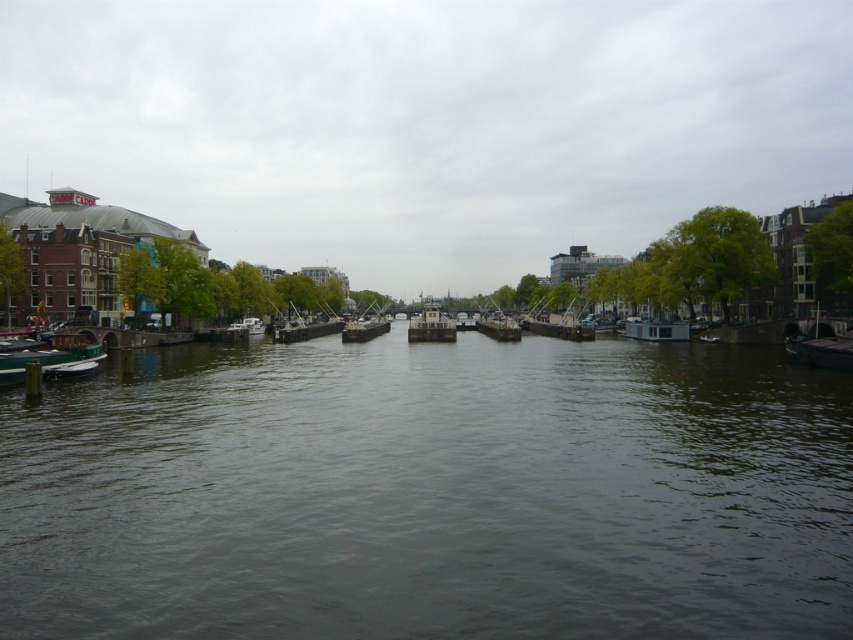
The height and width of the screenshot is (640, 853). What do you see at coordinates (49, 356) in the screenshot?
I see `green matte boat at lower left` at bounding box center [49, 356].

Is green matte boat at lower left shorter than metallic gray barge at center?

Yes, green matte boat at lower left is shorter than metallic gray barge at center.

Which is in front, point (67, 364) or point (378, 308)?

Point (67, 364)

Image resolution: width=853 pixels, height=640 pixels. In order to click on green matte boat at lower left in this screenshot , I will do `click(49, 356)`.

Image resolution: width=853 pixels, height=640 pixels. What do you see at coordinates (656, 330) in the screenshot?
I see `white matte houseboat at right` at bounding box center [656, 330].

Locate an element on the screen. This screenshot has height=640, width=853. white matte houseboat at right is located at coordinates (656, 330).

You are a GUI agent. You are given a task and a screenshot of the screen. Output one action in this format:
    pyautogui.click(x=<x>, y=<y>)
    Task: Click on the white matte houseboat at right
    The image size is (853, 640).
    Given the screenshot: What is the action you would take?
    pyautogui.click(x=656, y=330)

Who is taller, cloudy sky at center or metallic gray barge at center?

Standing taller between the two is cloudy sky at center.

Between cloudy sky at center and metallic gray barge at center, which one is positioned lower?

metallic gray barge at center

Between point (160, 99) and point (368, 328), which one is positioned in front?

Point (368, 328) is in front.

Locate an element on the screen. The width and height of the screenshot is (853, 640). cloudy sky at center is located at coordinates (427, 124).